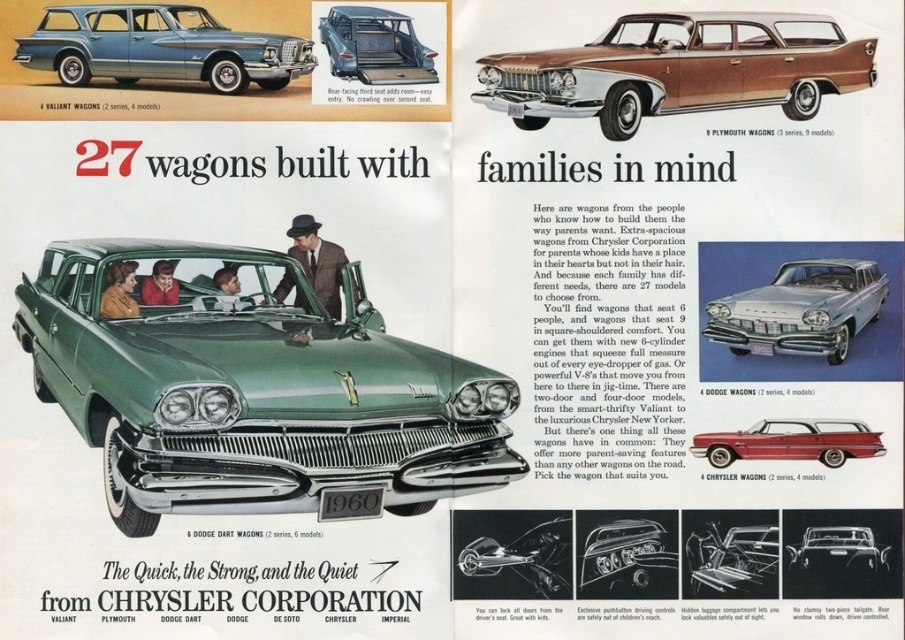
Who is more distant from viewer, (313, 424) or (700, 22)?

The point (700, 22) is more distant.

Does green metallic wagon at center appear on the right side of gold metallic station wagon at upper right?

No, green metallic wagon at center is not to the right of gold metallic station wagon at upper right.

This screenshot has height=640, width=905. I want to click on green metallic wagon at center, so click(251, 387).

Is green metallic wagon at center to the left of metallic blue station wagon at upper left from the viewer's perspective?

Incorrect, green metallic wagon at center is not on the left side of metallic blue station wagon at upper left.

Where is `green metallic wagon at center`? green metallic wagon at center is located at coordinates click(x=251, y=387).

What do you see at coordinates (251, 387) in the screenshot? The height and width of the screenshot is (640, 905). I see `green metallic wagon at center` at bounding box center [251, 387].

The height and width of the screenshot is (640, 905). I want to click on green metallic wagon at center, so click(251, 387).

Who is lower down, silver metallic sedan at center or shiny chrome grille at center?

shiny chrome grille at center is lower down.

This screenshot has width=905, height=640. Identify the location of silver metallic sedan at center. (801, 308).